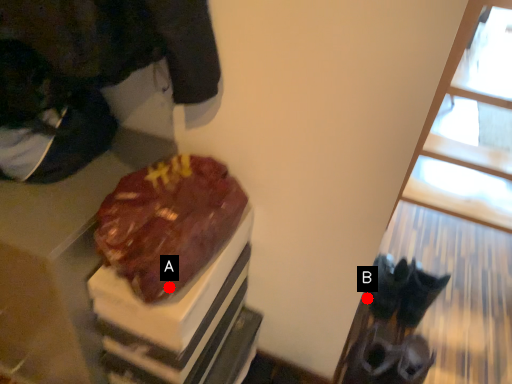
Question: Two points are circled on the image, labeled by A and B beside each circle. Which point is closer to the camera taking this photo?

Choices:
 (A) A is closer
 (B) B is closer

Answer: (A)